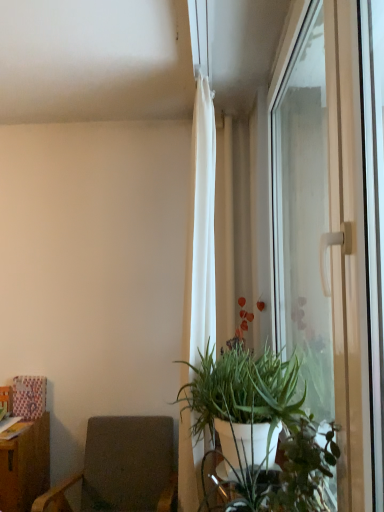
Question: Is dark gray fabric chair at lower left far from transparent glass window at right?

Choices:
 (A) no
 (B) yes

Answer: (B)

Question: Does dark gray fabric chair at lower left turn towards transparent glass window at right?

Choices:
 (A) no
 (B) yes

Answer: (A)

Question: Is dark gray fabric chair at lower left next to transparent glass window at right and touching it?

Choices:
 (A) yes
 (B) no

Answer: (B)

Question: From the image's perspective, does dark gray fabric chair at lower left appear higher than transparent glass window at right?

Choices:
 (A) yes
 (B) no

Answer: (B)

Question: Does dark gray fabric chair at lower left lie in front of transparent glass window at right?

Choices:
 (A) yes
 (B) no

Answer: (B)

Question: Does dark gray fabric chair at lower left appear on the right side of transparent glass window at right?

Choices:
 (A) yes
 (B) no

Answer: (B)

Question: Does white matte plant pot at lower right have a lesser height compared to white sheer curtain at upper center?

Choices:
 (A) yes
 (B) no

Answer: (A)

Question: Would you say white matte plant pot at lower right is outside white sheer curtain at upper center?

Choices:
 (A) yes
 (B) no

Answer: (A)

Question: Can you confirm if white matte plant pot at lower right is taller than white sheer curtain at upper center?

Choices:
 (A) yes
 (B) no

Answer: (B)

Question: Does white matte plant pot at lower right appear on the right side of white sheer curtain at upper center?

Choices:
 (A) yes
 (B) no

Answer: (A)

Question: Does white matte plant pot at lower right lie in front of white sheer curtain at upper center?

Choices:
 (A) yes
 (B) no

Answer: (A)

Question: Is white matte plant pot at lower right smaller than white sheer curtain at upper center?

Choices:
 (A) yes
 (B) no

Answer: (A)

Question: Considering the relative sizes of dark gray fabric chair at lower left and white sheer curtain at upper center in the image provided, is dark gray fabric chair at lower left taller than white sheer curtain at upper center?

Choices:
 (A) yes
 (B) no

Answer: (B)